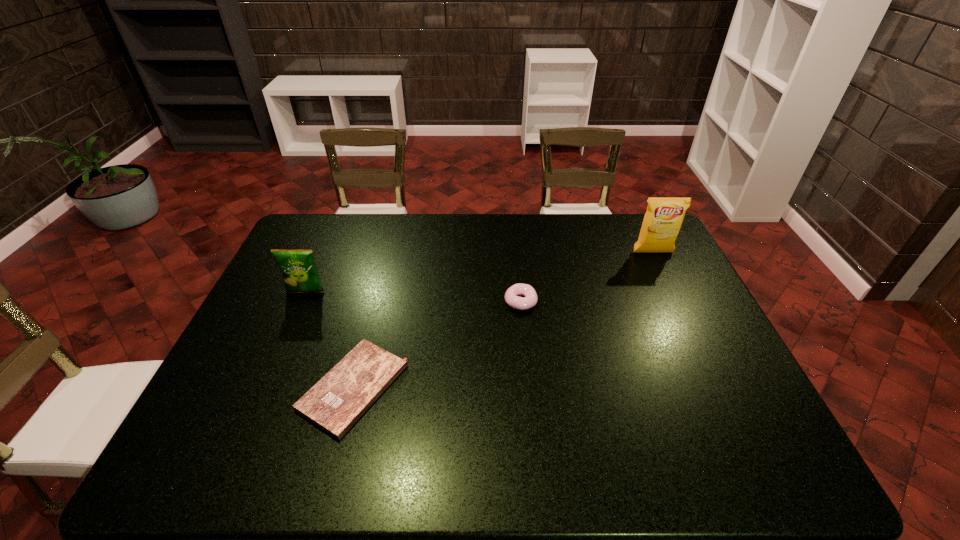
Identify the location of vacant space situated 0.280m on the left of the doughnut. The width and height of the screenshot is (960, 540). (413, 302).

What are the coordinates of `vacant space located 0.050m on the left of the Bible` in the screenshot? It's located at click(x=283, y=387).

The height and width of the screenshot is (540, 960). I want to click on object that is positioned at the far edge, so click(664, 216).

Locate an element on the screen. The width and height of the screenshot is (960, 540). object situated at the near edge is located at coordinates (335, 403).

I want to click on object positioned at the left edge, so click(299, 271).

Identify the location of object present at the right edge. The image size is (960, 540). (664, 216).

Locate an element on the screen. The height and width of the screenshot is (540, 960). object present at the far right corner is located at coordinates click(664, 216).

Locate an element on the screen. vacant position at the far edge of the desktop is located at coordinates (561, 215).

Image resolution: width=960 pixels, height=540 pixels. In order to click on free space at the near edge in this screenshot , I will do [546, 477].

In the image, there is a desktop. Where is `vacant area at the left edge`? The width and height of the screenshot is (960, 540). vacant area at the left edge is located at coordinates (270, 357).